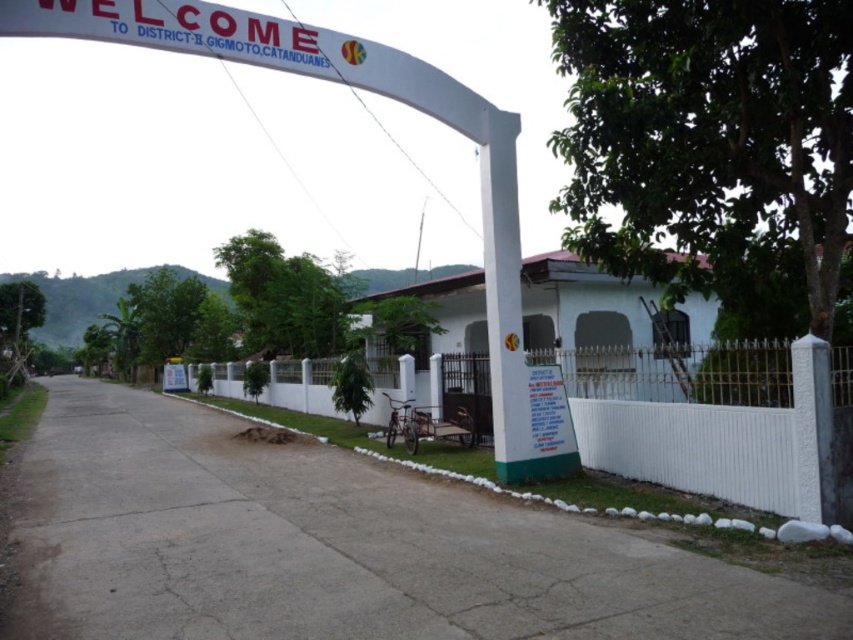
You are a delivery person standing at the entrance of District II, Gigmoto, Catanduanes. You need to place a package at the camera. The delivery zone requires that the package must be placed within 20 feet of the camera. Can you place the package at the white painted metal fence at center? Explain your reasoning.

The white painted metal fence at center and camera are 22.82 feet apart from each other. Since the delivery zone requires the package to be within 20 feet of the camera, placing it at the white painted metal fence at center would exceed the allowed distance. Therefore, it is not possible to place the package there and meet the requirement.

You are standing at the entrance of District II, Gigmoto, Catanduanes, looking at the archway and the building with a red roof. There are two points marked on the scene. Which point, point (848, 460) or point (602, 355), is closer to you?

Point (848, 460) is closer to the viewer than point (602, 355).

You are a visitor arriving at District II, Gigmoto, Catanduanes, and you see the white painted metal fence at center and the white matte building at center. Which structure is taller?

The white painted metal fence at center is not as tall as the white matte building at center, so the white matte building at center is taller.